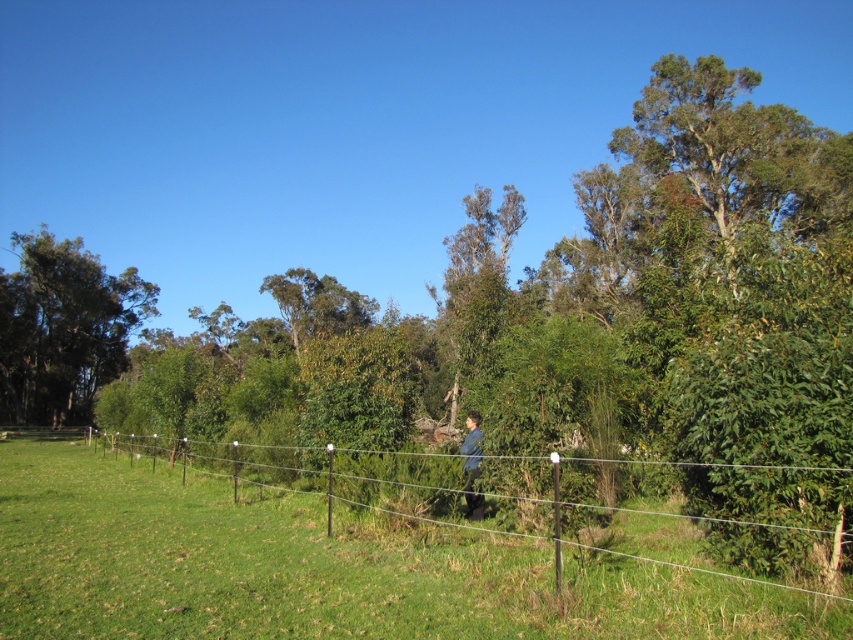
You are standing in the middle of the grassy field in the rural landscape. You notice two points marked in the image. Which point is nearer to you, point (430, 545) or point (77, 266)?

Point (430, 545) is closer to the viewer than point (77, 266).

You are standing at the center of the field in the image and want to walk towards the green wire fence at center. In which direction should you walk?

You should walk towards the center of the image because the green wire fence at center is located at point (384, 572), which is in the center area.